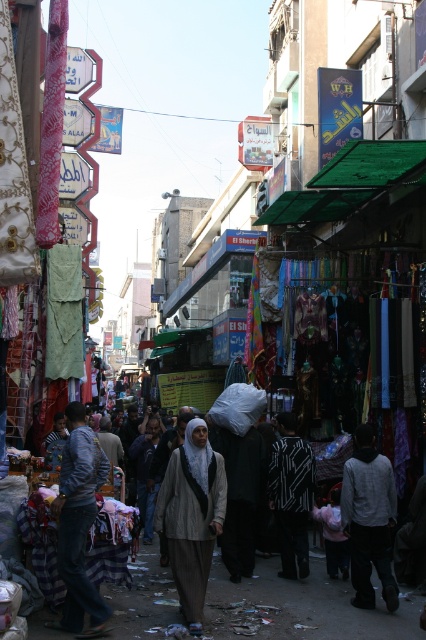
Question: Which point appears closest to the camera in this image?

Choices:
 (A) (353, 534)
 (B) (224, 465)

Answer: (A)

Question: Which point is closer to the camera taking this photo?

Choices:
 (A) (377, 484)
 (B) (167, 524)

Answer: (A)

Question: Can you confirm if light brown fabric hijab at center is positioned above dark gray hoodie at center?

Choices:
 (A) no
 (B) yes

Answer: (A)

Question: Does light brown fabric hijab at center have a smaller size compared to dark gray hoodie at center?

Choices:
 (A) yes
 (B) no

Answer: (A)

Question: Does light brown fabric hijab at center appear under dark gray hoodie at center?

Choices:
 (A) no
 (B) yes

Answer: (B)